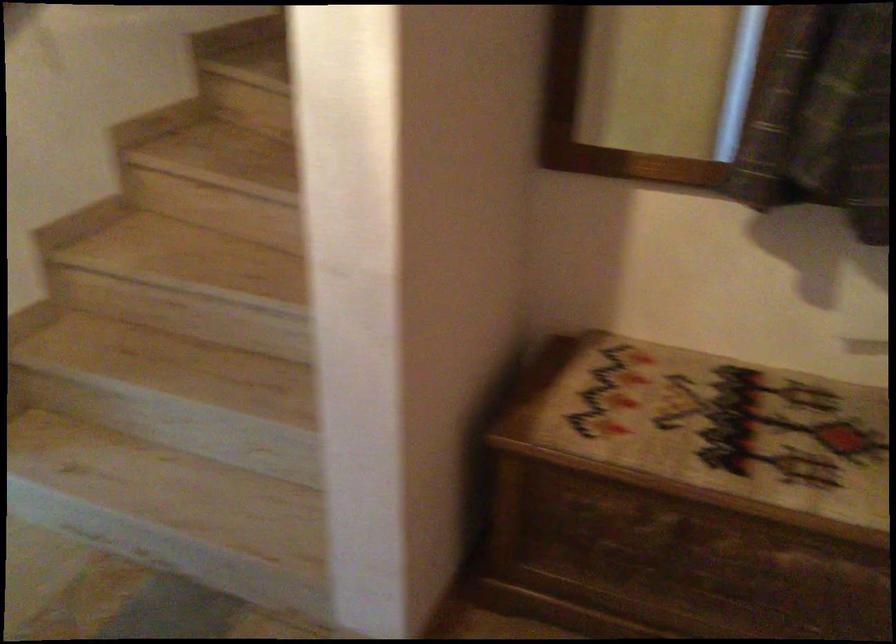
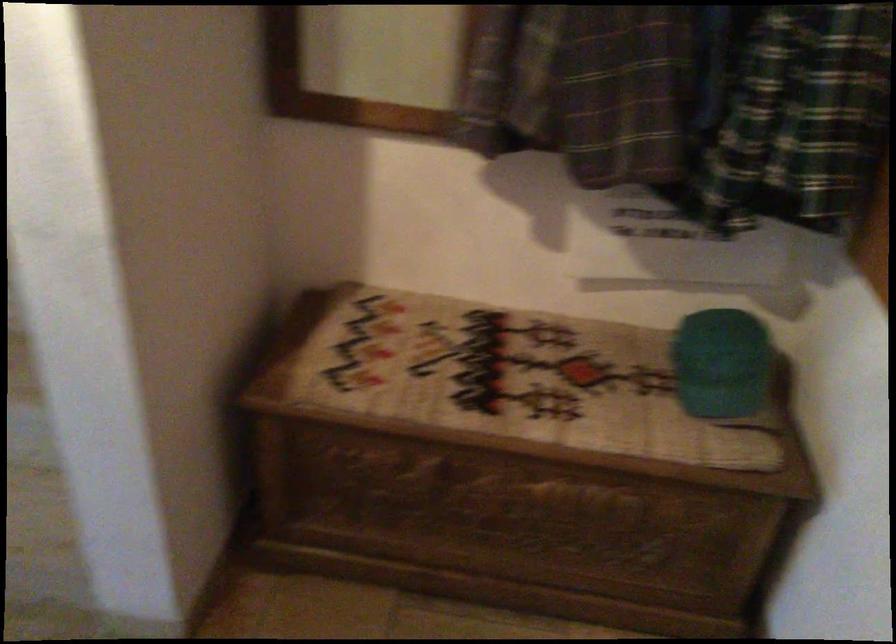
Question: The images are taken continuously from a first-person perspective. In which direction is your viewpoint rotating?

Choices:
 (A) Left
 (B) Right
 (C) Up
 (D) Down

Answer: (B)